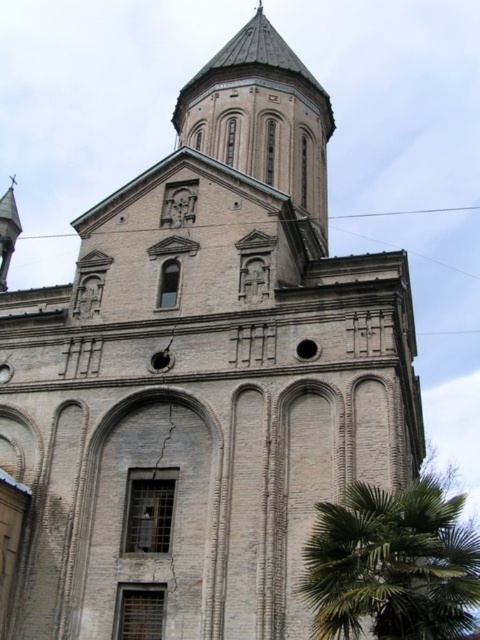
You are standing in front of the historic building and want to place a decorative pot exactly at the same 2D location as the green leafy palm at lower right. What are the coordinates you should input into the GPS device for this placement?

The coordinates for the green leafy palm at lower right are at point [392,563]. You should input these coordinates into the GPS device to place the decorative pot at the same location.

You are standing in front of the historic building and want to take a photo that includes both the green leafy palm at lower right and the brown stone bell tower at upper center. Which object should you position closer to the bottom of your camera frame?

The green leafy palm at lower right should be positioned closer to the bottom of your camera frame because it is shorter than the brown stone bell tower at upper center.